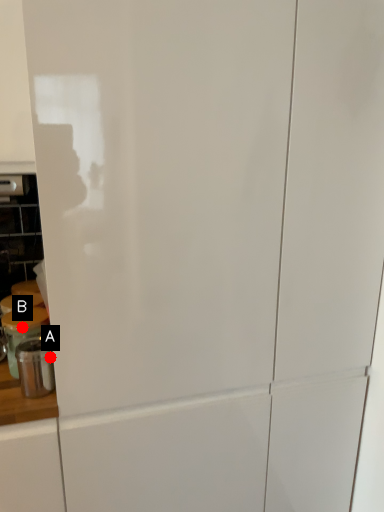
Question: Two points are circled on the image, labeled by A and B beside each circle. Which point is farther from the camera taking this photo?

Choices:
 (A) A is further
 (B) B is further

Answer: (B)